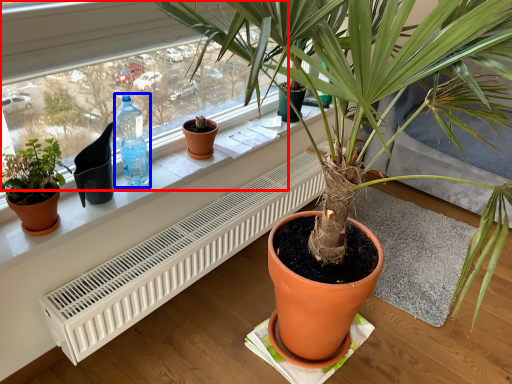
Question: Which point is closer to the camera, bay window (highlighted by a red box) or bottle (highlighted by a blue box)?

Choices:
 (A) bay window
 (B) bottle

Answer: (A)